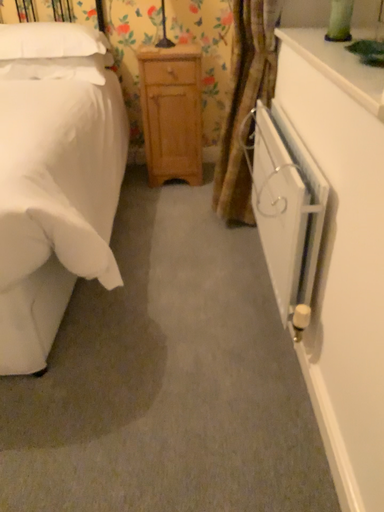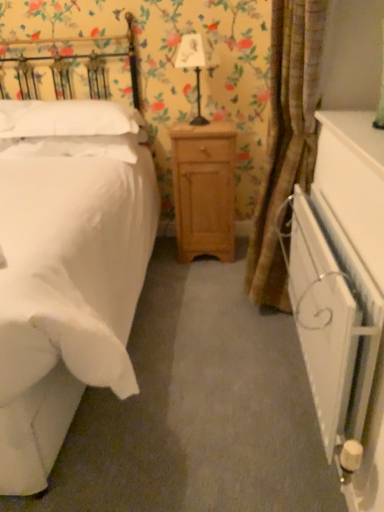
Question: Which way did the camera rotate in the video?

Choices:
 (A) rotated downward
 (B) rotated upward

Answer: (B)